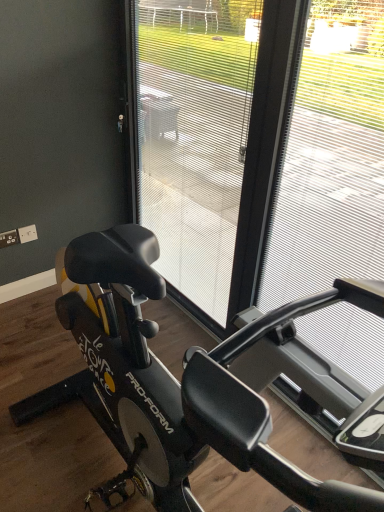
Measure the distance between black matte stationary bicycle at center and camera.

black matte stationary bicycle at center and camera are 3.45 feet apart from each other.

What do you see at coordinates (195, 136) in the screenshot?
I see `transparent plastic screen door at center` at bounding box center [195, 136].

Locate an element on the screen. This screenshot has height=512, width=384. black matte stationary bicycle at center is located at coordinates (176, 380).

From the image's perspective, is black matte stationary bicycle at center positioned above or below transparent plastic screen door at center?

From the image's perspective, black matte stationary bicycle at center appears below transparent plastic screen door at center.

Does black matte stationary bicycle at center have a greater width compared to transparent plastic screen door at center?

Correct, the width of black matte stationary bicycle at center exceeds that of transparent plastic screen door at center.

From a real-world perspective, is black matte stationary bicycle at center above or below transparent plastic screen door at center?

black matte stationary bicycle at center is below transparent plastic screen door at center.

Could you tell me if black matte stationary bicycle at center is turned towards transparent plastic screen door at center?

No, black matte stationary bicycle at center does not turn towards transparent plastic screen door at center.

Between transparent plastic screen door at center and black matte stationary bicycle at center, which one appears on the left side from the viewer's perspective?

Positioned to the left is black matte stationary bicycle at center.

Is transparent plastic screen door at center thinner than black matte stationary bicycle at center?

Yes.

Which is in front, transparent plastic screen door at center or black matte stationary bicycle at center?

black matte stationary bicycle at center is closer to the camera.

From the image's perspective, is metallic silver frame at right located above or below transparent plastic screen door at center?

Clearly, from the image's perspective, metallic silver frame at right is below transparent plastic screen door at center.

Considering the relative sizes of metallic silver frame at right and transparent plastic screen door at center in the image provided, is metallic silver frame at right taller than transparent plastic screen door at center?

Yes.

From a real-world perspective, is metallic silver frame at right under transparent plastic screen door at center?

No, from a real-world perspective, metallic silver frame at right is not beneath transparent plastic screen door at center.

Considering their positions, is metallic silver frame at right located in front of or behind transparent plastic screen door at center?

Clearly, metallic silver frame at right is in front of transparent plastic screen door at center.

From the image's perspective, is black matte stationary bicycle at center above metallic silver frame at right?

Incorrect, from the image's perspective, black matte stationary bicycle at center is lower than metallic silver frame at right.

Is black matte stationary bicycle at center facing away from metallic silver frame at right?

No.

Is black matte stationary bicycle at center directly adjacent to metallic silver frame at right?

No, black matte stationary bicycle at center is not with metallic silver frame at right.

From a real-world perspective, is black matte stationary bicycle at center under metallic silver frame at right?

Yes, from a real-world perspective, black matte stationary bicycle at center is below metallic silver frame at right.

Measure the distance between transparent plastic screen door at center and metallic silver frame at right.

transparent plastic screen door at center is 3.12 meters from metallic silver frame at right.

Does transparent plastic screen door at center have a smaller size compared to metallic silver frame at right?

Incorrect, transparent plastic screen door at center is not smaller in size than metallic silver frame at right.

Based on the photo, is transparent plastic screen door at center spatially inside metallic silver frame at right, or outside of it?

transparent plastic screen door at center is outside metallic silver frame at right.

Does transparent plastic screen door at center have a greater width compared to metallic silver frame at right?

Yes, transparent plastic screen door at center is wider than metallic silver frame at right.

Looking at this image, from the image's perspective, is metallic silver frame at right located above or below black matte stationary bicycle at center?

From the image's perspective, metallic silver frame at right appears above black matte stationary bicycle at center.

Considering the sizes of objects metallic silver frame at right and black matte stationary bicycle at center in the image provided, who is shorter, metallic silver frame at right or black matte stationary bicycle at center?

black matte stationary bicycle at center.

Can you confirm if metallic silver frame at right is positioned to the right of black matte stationary bicycle at center?

Indeed, metallic silver frame at right is positioned on the right side of black matte stationary bicycle at center.

Where is `stationary bicycle on the left of the transparent plastic screen door at center`? stationary bicycle on the left of the transparent plastic screen door at center is located at coordinates (176, 380).

I want to click on screen door above the black matte stationary bicycle at center (from the image's perspective), so click(195, 136).

Consider the image. Based on their spatial positions, is metallic silver frame at right or transparent plastic screen door at center closer to black matte stationary bicycle at center?

metallic silver frame at right lies closer to black matte stationary bicycle at center than the other object.

Based on their spatial positions, is transparent plastic screen door at center or metallic silver frame at right closer to black matte stationary bicycle at center?

The object closer to black matte stationary bicycle at center is metallic silver frame at right.

Based on the photo, which object lies nearer to the anchor point metallic silver frame at right, transparent plastic screen door at center or black matte stationary bicycle at center?

black matte stationary bicycle at center is closer to metallic silver frame at right.

Considering their positions, is black matte stationary bicycle at center positioned further to metallic silver frame at right than transparent plastic screen door at center?

Among the two, transparent plastic screen door at center is located further to metallic silver frame at right.

When comparing their distances from transparent plastic screen door at center, does metallic silver frame at right or black matte stationary bicycle at center seem closer?

Based on the image, metallic silver frame at right appears to be nearer to transparent plastic screen door at center.

Based on their spatial positions, is black matte stationary bicycle at center or metallic silver frame at right closer to transparent plastic screen door at center?

Among the two, metallic silver frame at right is located nearer to transparent plastic screen door at center.

Identify the location of window frame between transparent plastic screen door at center and black matte stationary bicycle at center vertically. (331, 158).